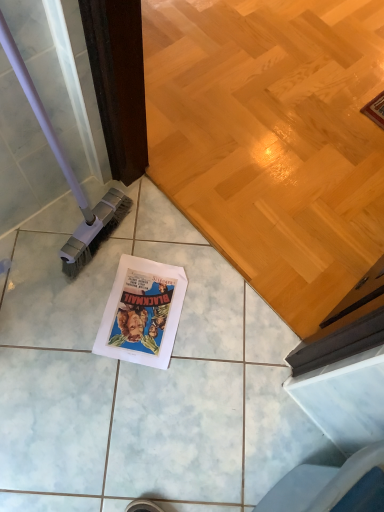
Question: Is there a large distance between purple plastic brush at left and white paper comic book at center?

Choices:
 (A) yes
 (B) no

Answer: (B)

Question: Is purple plastic brush at left outside white paper comic book at center?

Choices:
 (A) no
 (B) yes

Answer: (B)

Question: Would you say purple plastic brush at left contains white paper comic book at center?

Choices:
 (A) yes
 (B) no

Answer: (B)

Question: Can you confirm if purple plastic brush at left is shorter than white paper comic book at center?

Choices:
 (A) no
 (B) yes

Answer: (A)

Question: Does purple plastic brush at left lie behind white paper comic book at center?

Choices:
 (A) no
 (B) yes

Answer: (A)

Question: From the image's perspective, does purple plastic brush at left appear lower than white paper comic book at center?

Choices:
 (A) yes
 (B) no

Answer: (B)

Question: Considering the relative positions of white paper comic book at center and purple plastic brush at left in the image provided, is white paper comic book at center in front of purple plastic brush at left?

Choices:
 (A) yes
 (B) no

Answer: (B)

Question: From a real-world perspective, is white paper comic book at center located higher than purple plastic brush at left?

Choices:
 (A) yes
 (B) no

Answer: (B)

Question: Does white paper comic book at center contain purple plastic brush at left?

Choices:
 (A) yes
 (B) no

Answer: (B)

Question: Are white paper comic book at center and purple plastic brush at left making contact?

Choices:
 (A) yes
 (B) no

Answer: (B)

Question: Considering the relative sizes of white paper comic book at center and purple plastic brush at left in the image provided, is white paper comic book at center bigger than purple plastic brush at left?

Choices:
 (A) no
 (B) yes

Answer: (A)

Question: Considering the relative sizes of white paper comic book at center and purple plastic brush at left in the image provided, is white paper comic book at center taller than purple plastic brush at left?

Choices:
 (A) no
 (B) yes

Answer: (A)

Question: Considering the positions of purple plastic brush at left and white paper comic book at center in the image, is purple plastic brush at left wider or thinner than white paper comic book at center?

Choices:
 (A) thin
 (B) wide

Answer: (A)